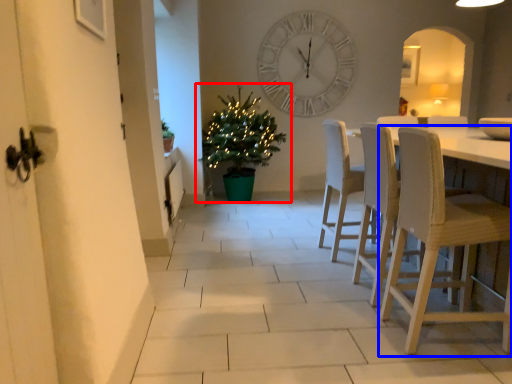
Question: Which object appears closest to the camera in this image, houseplant (highlighted by a red box) or chair (highlighted by a blue box)?

Choices:
 (A) houseplant
 (B) chair

Answer: (B)